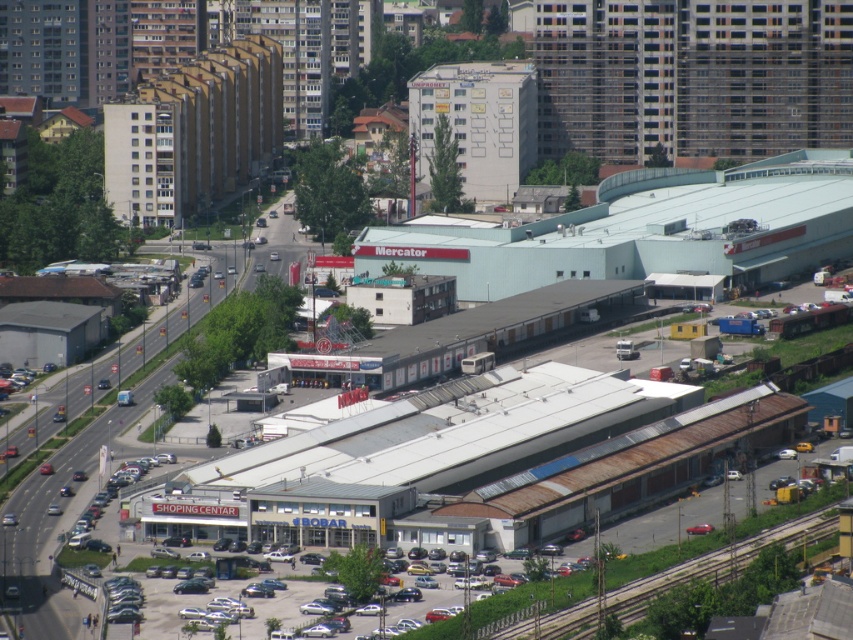
You are standing at the point marked as point [691,76] in the image. Based on the scene description, what structure are you currently located on?

The point [691,76] is located on the white corrugated metal shopping center at center, so you are currently on the white corrugated metal shopping center at center.

You are a delivery driver who needs to park your truck near the white corrugated metal shopping center at center and the rusty metal train track at lower right. Based on the scene, can you determine which of these two landmarks is closer to the parking lot?

The white corrugated metal shopping center at center is to the left of rusty metal train track at lower right. Since the parking lot is adjacent to the industrial buildings and the shopping center is part of that area, the white corrugated metal shopping center at center is closer to the parking lot than the rusty metal train track at lower right.